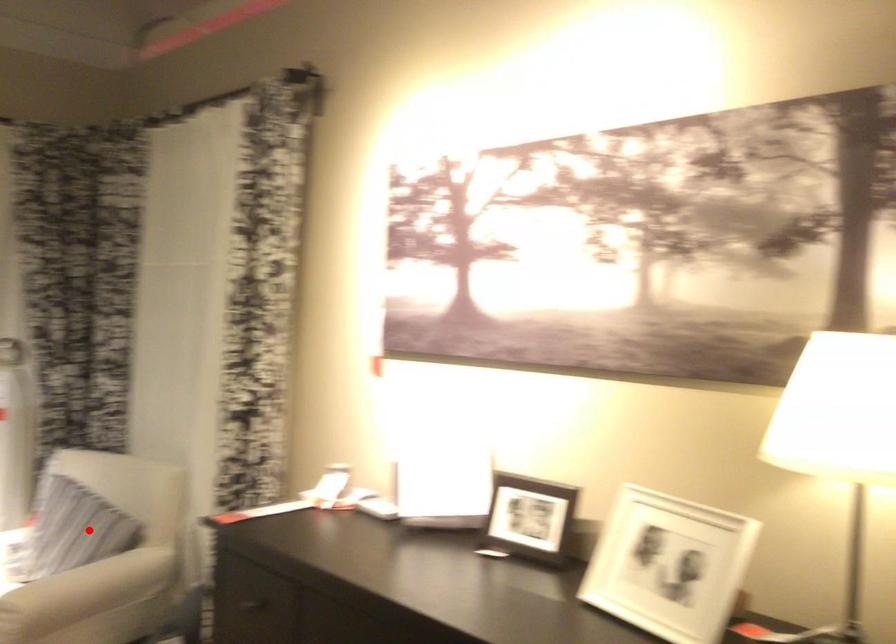
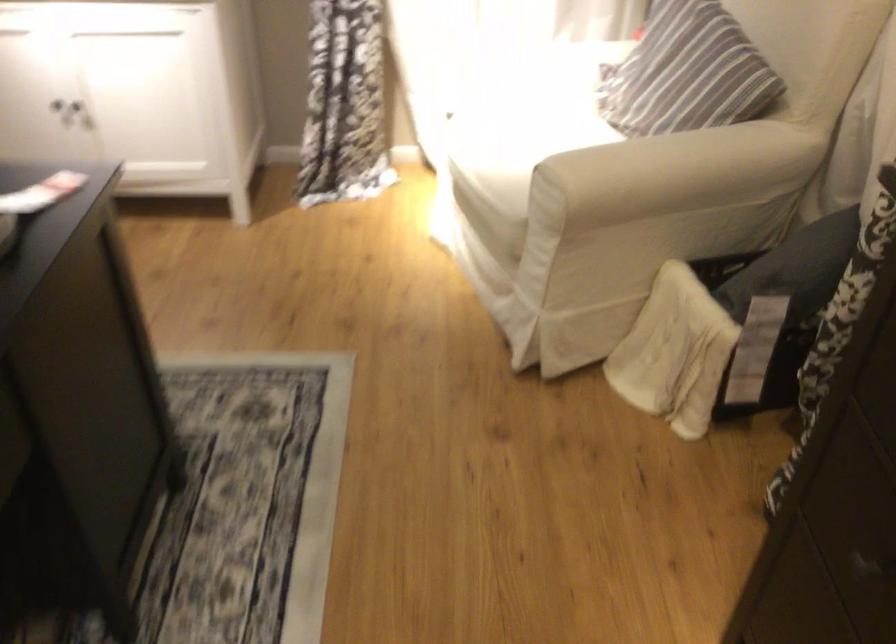
Question: A red point is marked in image1. In image2, is the corresponding 3D point closer to the camera or farther? Reply with the corresponding letter.

Choices:
 (A) The corresponding 3D point is closer.
 (B) The corresponding 3D point is farther.

Answer: (A)